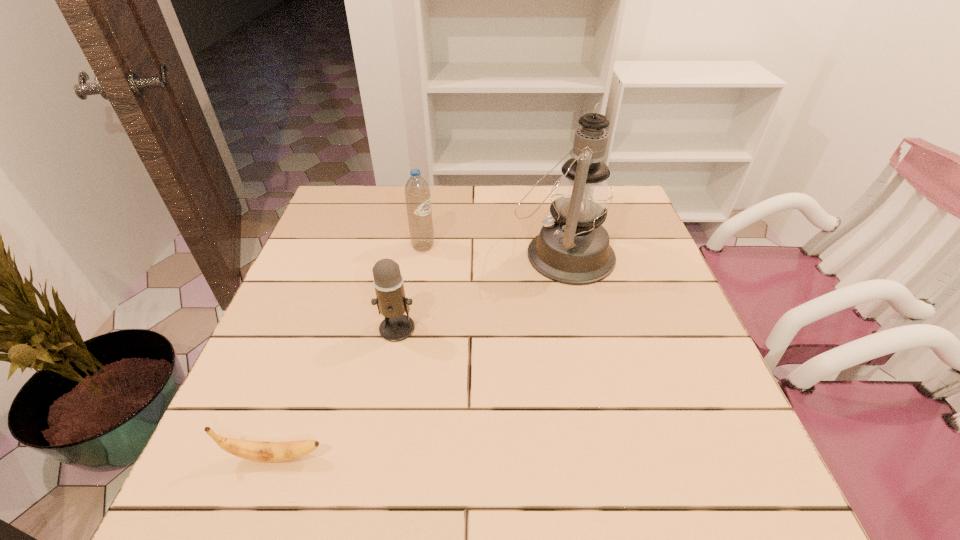
Locate an element on the screen. object positioned at the far edge is located at coordinates (573, 248).

Find the location of a particular element. Image resolution: width=960 pixels, height=540 pixels. object that is positioned at the near edge is located at coordinates (261, 451).

I want to click on object present at the left edge, so [261, 451].

Locate an element on the screen. object situated at the right edge is located at coordinates (573, 248).

Identify the location of object located in the near left corner section of the desktop. point(261,451).

Find the location of a particular element. This screenshot has height=540, width=960. object that is positioned at the far right corner is located at coordinates (573, 248).

Find the location of a particular element. The image size is (960, 540). free point at the far edge is located at coordinates (451, 218).

Where is `vacant region at the near edge of the desktop`? vacant region at the near edge of the desktop is located at coordinates (397, 475).

Where is `vacant space at the left edge of the desktop`? vacant space at the left edge of the desktop is located at coordinates (329, 310).

You are a GUI agent. You are given a task and a screenshot of the screen. Output one action in this format:
    pyautogui.click(x=<x>, y=<y>)
    Task: Click on the vacant space at the right edge of the desktop
    
    Given the screenshot: What is the action you would take?
    pyautogui.click(x=686, y=401)